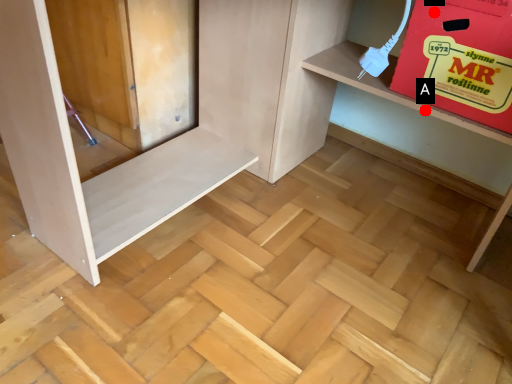
Question: Two points are circled on the image, labeled by A and B beside each circle. Which point appears farthest from the camera in this image?

Choices:
 (A) A is further
 (B) B is further

Answer: (A)